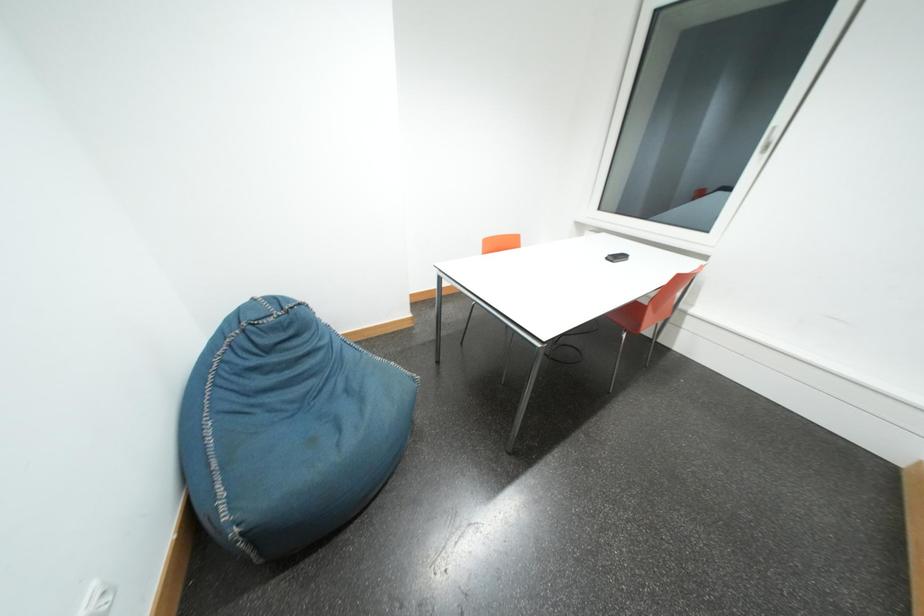
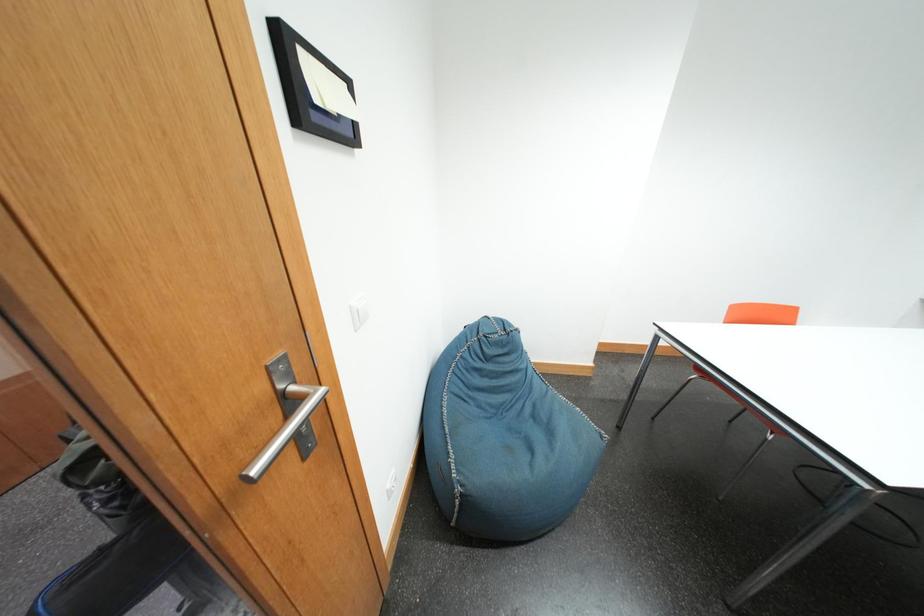
Question: The camera is either moving clockwise (left) or counter-clockwise (right) around the object. The first image is from the beginning of the video and the second image is from the end. Is the camera moving left or right when shooting the video?

Choices:
 (A) Left
 (B) Right

Answer: (B)